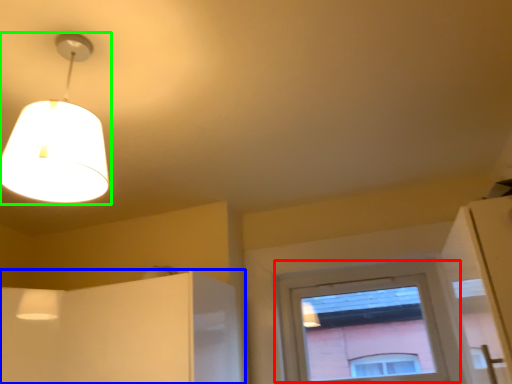
Question: Which object is positioned farthest from window (highlighted by a red box)? Select from cabinetry (highlighted by a blue box) and lamp (highlighted by a green box).

Choices:
 (A) cabinetry
 (B) lamp

Answer: (B)